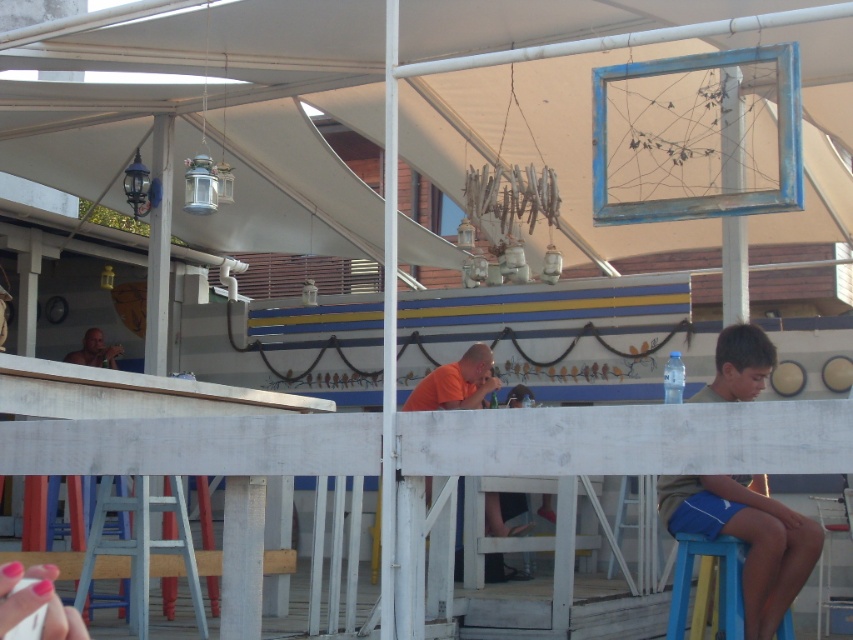
Who is shorter, orange matte shirt at center or shiny orange shirt at upper left?

shiny orange shirt at upper left is shorter.

Is point (466, 406) farther from viewer compared to point (114, 364)?

No, it is not.

Image resolution: width=853 pixels, height=640 pixels. In order to click on orange matte shirt at center in this screenshot , I will do `click(456, 381)`.

Is orange matte shirt at center positioned behind blue plastic stool at lower right?

Yes, it is behind blue plastic stool at lower right.

Which is in front, point (425, 397) or point (676, 616)?

Point (676, 616) is in front.

Locate an element on the screen. This screenshot has height=640, width=853. orange matte shirt at center is located at coordinates (456, 381).

Which is above, light brown shorts at right or shiny orange shirt at upper left?

Positioned higher is shiny orange shirt at upper left.

Does light brown shorts at right come in front of shiny orange shirt at upper left?

Yes.

Does point (756, 580) lie in front of point (107, 348)?

Yes.

You are a GUI agent. You are given a task and a screenshot of the screen. Output one action in this format:
    pyautogui.click(x=<x>, y=<y>)
    Task: Click on the light brown shorts at right
    
    Given the screenshot: What is the action you would take?
    pyautogui.click(x=747, y=538)